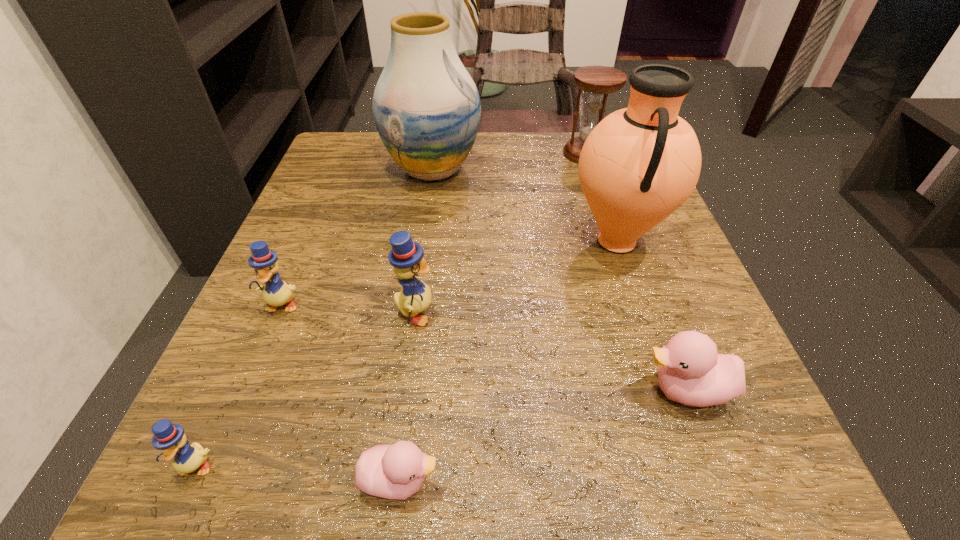
The height and width of the screenshot is (540, 960). I want to click on free spot between the rightmost yellow duckling and the hourglass, so click(x=501, y=234).

Where is `empty space between the nearest yellow duckling and the farther pink duckling`? This screenshot has height=540, width=960. empty space between the nearest yellow duckling and the farther pink duckling is located at coordinates (441, 428).

Locate an element on the screen. The width and height of the screenshot is (960, 540). vacant area that lies between the right pink duckling and the nearer pink duckling is located at coordinates (542, 435).

Identify which object is located as the sixth nearest to the sixth nearest object. Please provide its 2D coordinates. Your answer should be formatted as a tuple, i.e. [(x, y)], where the tuple contains the x and y coordinates of a point satisfying the conditions above.

[(276, 292)]

Locate which object is the seventh closest to the vase. Please provide its 2D coordinates. Your answer should be formatted as a tuple, i.e. [(x, y)], where the tuple contains the x and y coordinates of a point satisfying the conditions above.

[(170, 438)]

The image size is (960, 540). I want to click on the second closest duckling to the third nearest duckling, so 406,256.

Select which duckling appears as the third closest to the third farthest object. Please provide its 2D coordinates. Your answer should be formatted as a tuple, i.e. [(x, y)], where the tuple contains the x and y coordinates of a point satisfying the conditions above.

[(396, 471)]

Locate which yellow duckling is the closest to the biggest yellow duckling. Please provide its 2D coordinates. Your answer should be formatted as a tuple, i.e. [(x, y)], where the tuple contains the x and y coordinates of a point satisfying the conditions above.

[(276, 292)]

Locate which yellow duckling is the closest to the sixth nearest object. Please provide its 2D coordinates. Your answer should be formatted as a tuple, i.e. [(x, y)], where the tuple contains the x and y coordinates of a point satisfying the conditions above.

[(406, 256)]

I want to click on free space that satisfies the following two spatial constraints: 1. on the front-facing side of the sixth farthest object; 2. on the face of the smallest yellow duckling, where the monocle is placed, so click(x=713, y=465).